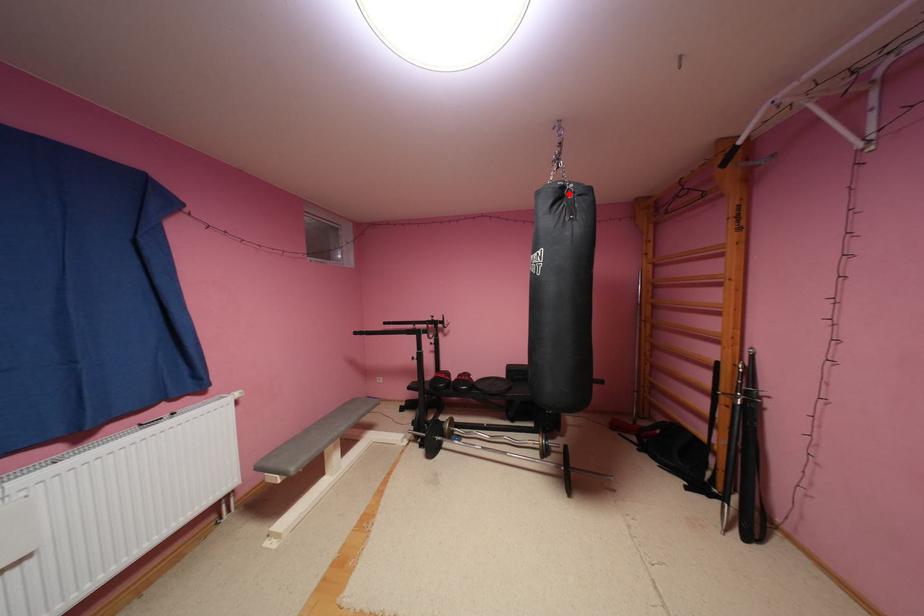
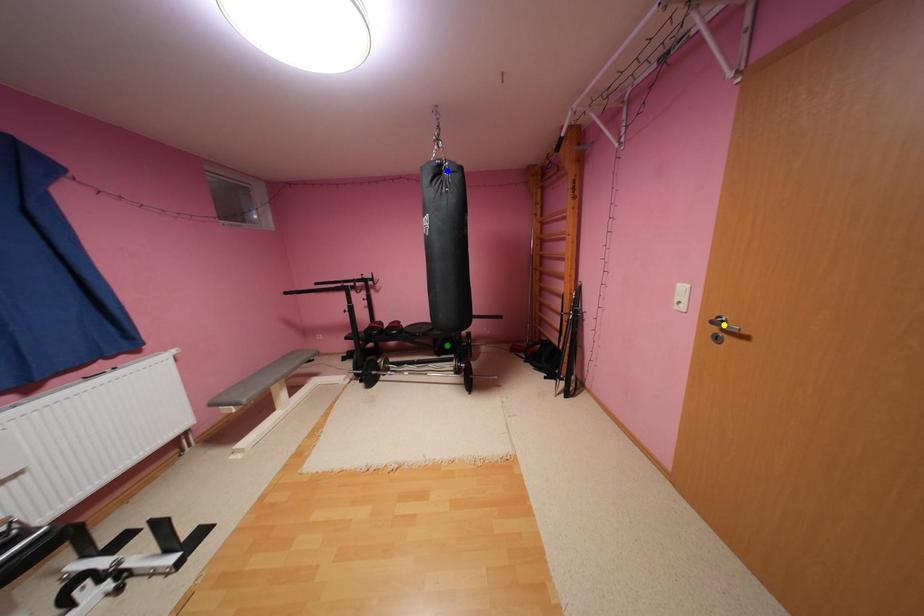
Question: I am providing you with two images of the same scene from different viewpoints. A red point is marked on the first image. You are given multiple points on the second image. Which point in image 2 is actually the same real-world point as the red point in image 1?

Choices:
 (A) green point
 (B) blue point
 (C) yellow point

Answer: (B)